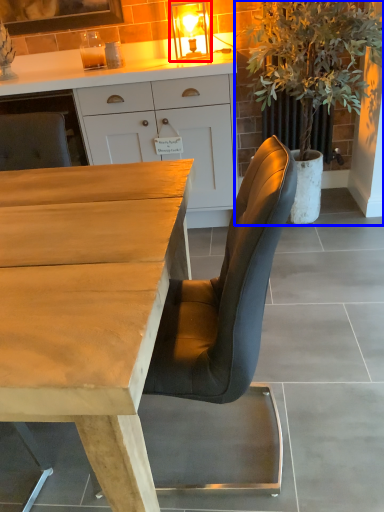
Question: Which of the following is the farthest to the observer, light fixture (highlighted by a red box) or houseplant (highlighted by a blue box)?

Choices:
 (A) light fixture
 (B) houseplant

Answer: (A)